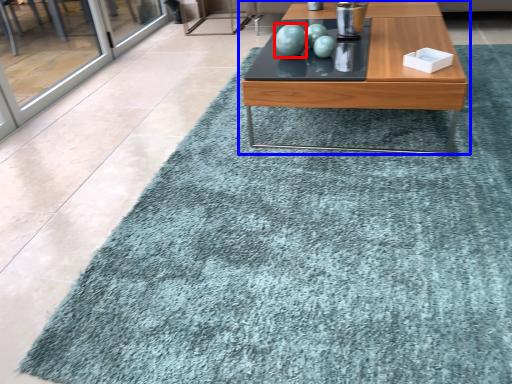
Question: Which point is further to the camera, turquoise (highlighted by a red box) or coffee table (highlighted by a blue box)?

Choices:
 (A) turquoise
 (B) coffee table

Answer: (A)